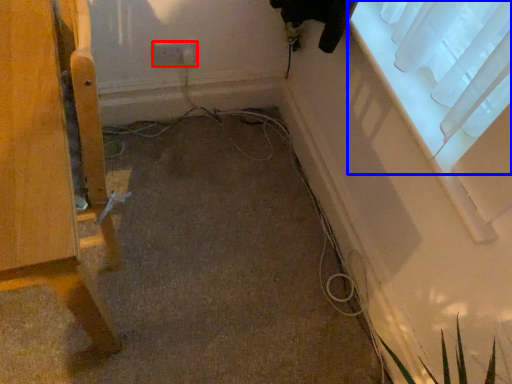
Question: Among these objects, which one is farthest to the camera, electric outlet (highlighted by a red box) or window (highlighted by a blue box)?

Choices:
 (A) electric outlet
 (B) window

Answer: (A)